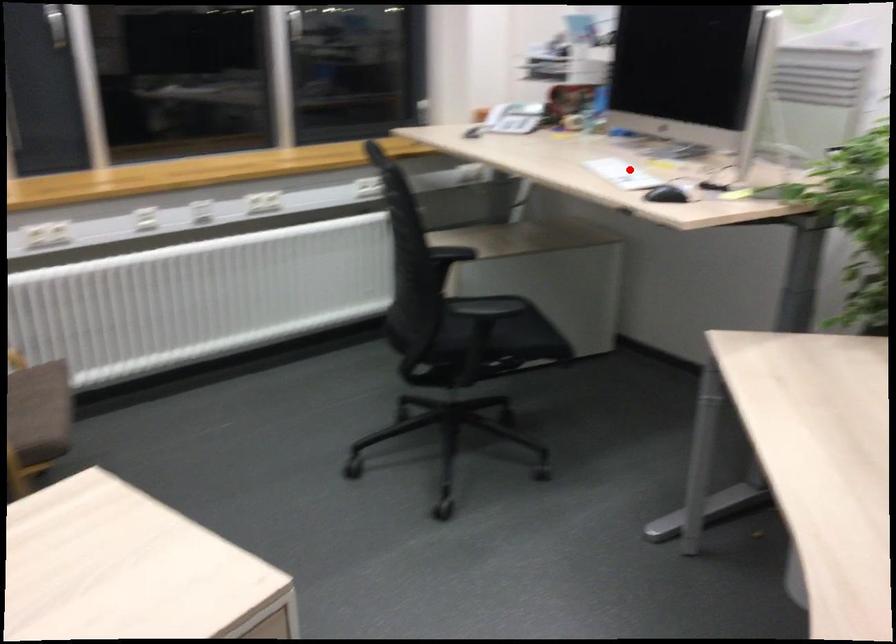
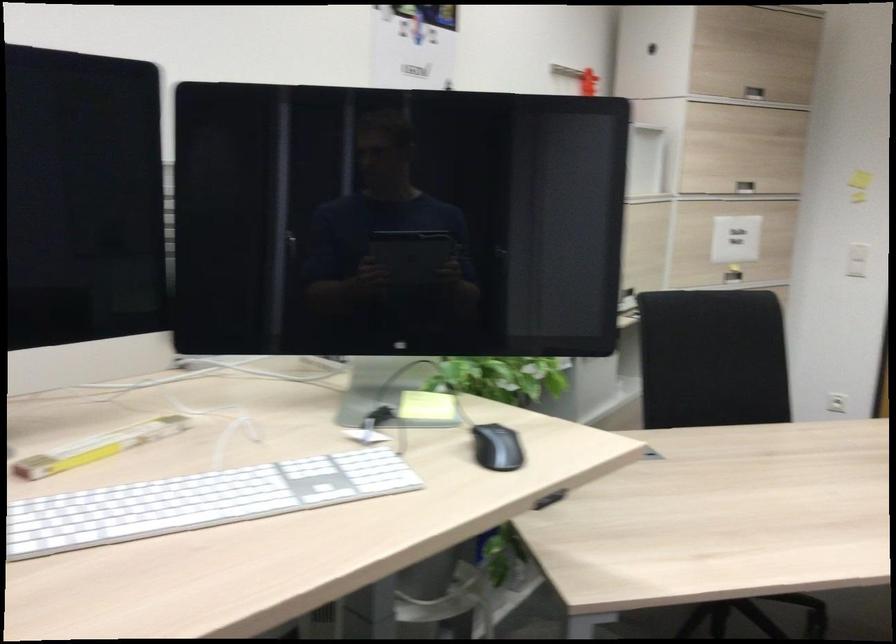
Question: I am providing you with two images of the same scene from different viewpoints. Image1 has a red point marked. In image2, the corresponding 3D location appears at what relative position? Reply with the corresponding letter.

Choices:
 (A) Closer
 (B) Farther

Answer: (A)